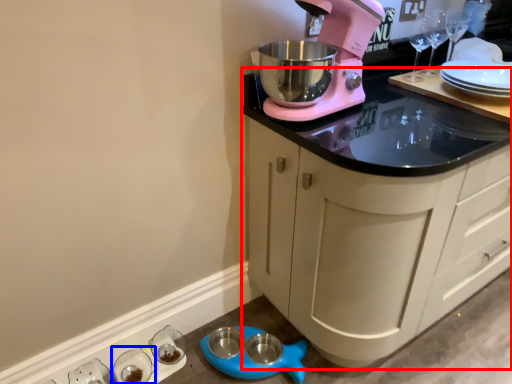
Question: Among these objects, which one is farthest to the camera, cabinetry (highlighted by a red box) or tableware (highlighted by a blue box)?

Choices:
 (A) cabinetry
 (B) tableware

Answer: (B)